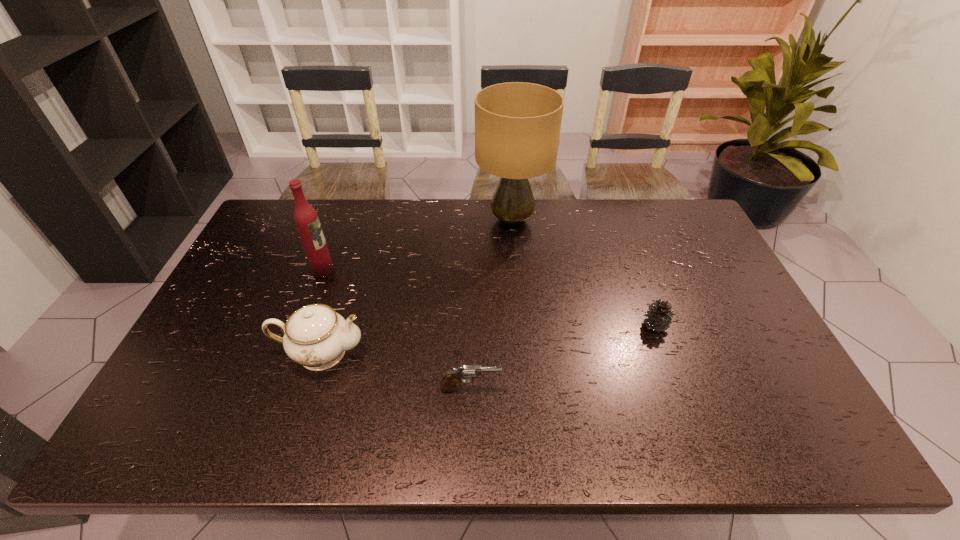
Locate an element on the screen. Image resolution: width=960 pixels, height=540 pixels. vacant space that satisfies the following two spatial constraints: 1. on the label of the rightmost object; 2. on the right side of the fourth shortest object is located at coordinates (302, 325).

Find the location of a particular element. The width and height of the screenshot is (960, 540). free space that satisfies the following two spatial constraints: 1. on the front side of the farthest object; 2. at the barrel of the nearest object is located at coordinates (526, 389).

Find the location of `blank space that satisfies the following two spatial constraints: 1. on the front side of the pinecone; 2. at the barrel of the pistol`. blank space that satisfies the following two spatial constraints: 1. on the front side of the pinecone; 2. at the barrel of the pistol is located at coordinates (679, 389).